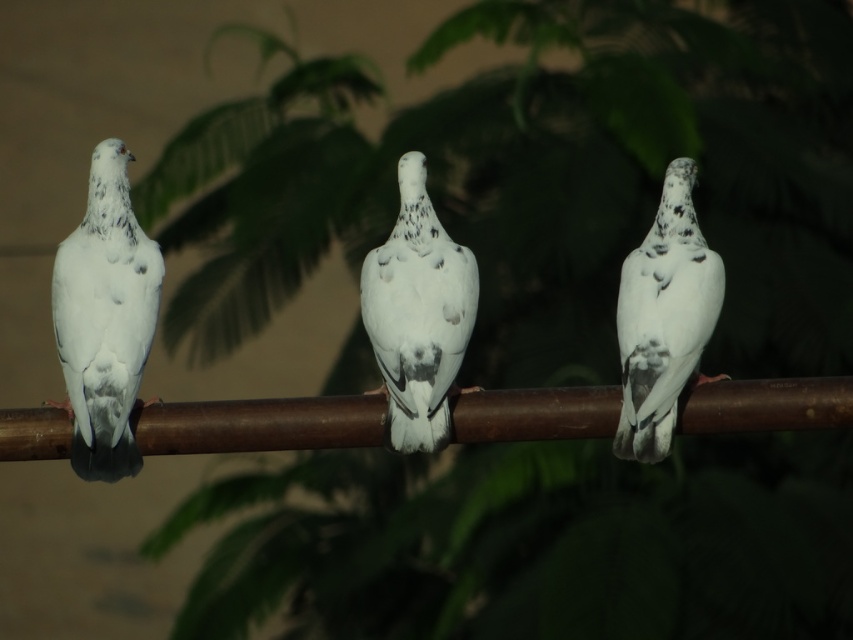
Question: Is speckled white pigeon at left further to camera compared to speckled white dove at right?

Choices:
 (A) no
 (B) yes

Answer: (A)

Question: Which point is closer to the camera?

Choices:
 (A) (x=94, y=392)
 (B) (x=309, y=413)
 (C) (x=444, y=424)

Answer: (A)

Question: Which is farther from the rusty metal branch at center?

Choices:
 (A) speckled white bird at center
 (B) speckled white dove at right
 (C) speckled white pigeon at left

Answer: (C)

Question: Which object appears farthest from the camera in this image?

Choices:
 (A) rusty metal branch at center
 (B) speckled white pigeon at left
 (C) speckled white dove at right
 (D) speckled white bird at center

Answer: (D)

Question: Does speckled white pigeon at left have a greater width compared to speckled white dove at right?

Choices:
 (A) yes
 (B) no

Answer: (A)

Question: Is speckled white pigeon at left positioned before speckled white dove at right?

Choices:
 (A) yes
 (B) no

Answer: (A)